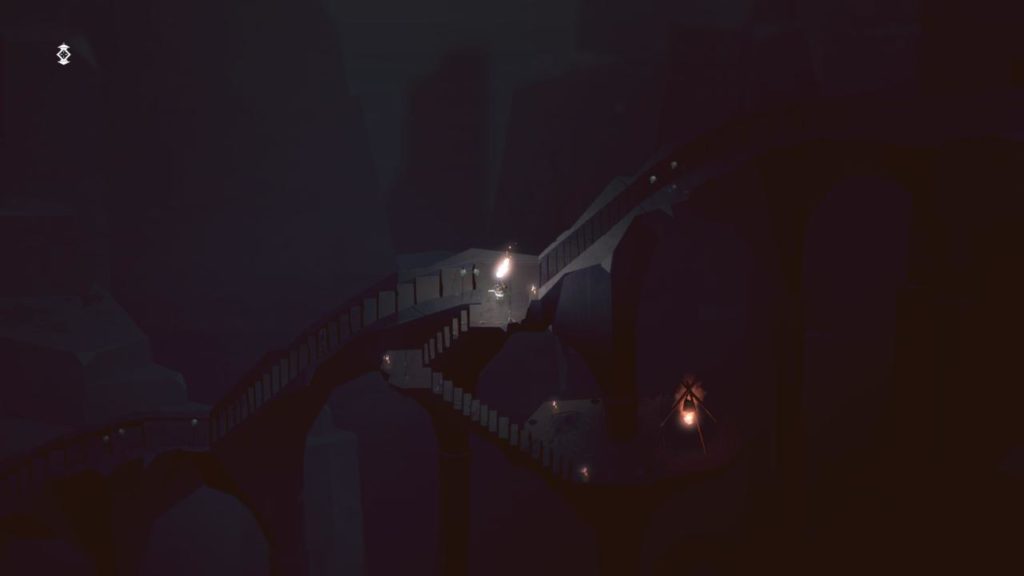
This screenshot has height=576, width=1024. What are the coordinates of `bulb` in the screenshot? It's located at (687, 418).